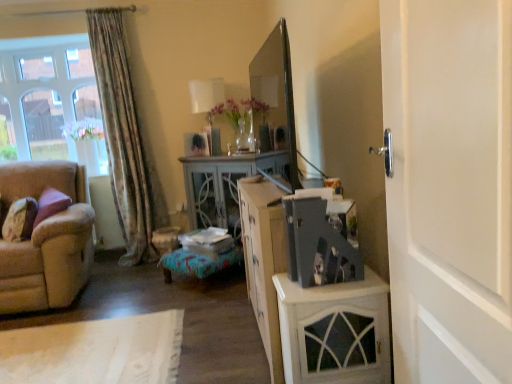
Question: Is clear glass window at upper left at the back of white painted wood door at right?

Choices:
 (A) yes
 (B) no

Answer: (B)

Question: Is the surface of white painted wood door at right in direct contact with clear glass window at upper left?

Choices:
 (A) no
 (B) yes

Answer: (A)

Question: Is white painted wood door at right positioned beyond the bounds of clear glass window at upper left?

Choices:
 (A) no
 (B) yes

Answer: (B)

Question: Could you tell me if white painted wood door at right is turned towards clear glass window at upper left?

Choices:
 (A) yes
 (B) no

Answer: (B)

Question: Is white painted wood door at right closer to camera compared to clear glass window at upper left?

Choices:
 (A) no
 (B) yes

Answer: (B)

Question: Considering the positions of point (305, 288) and point (306, 240), is point (305, 288) closer or farther from the camera than point (306, 240)?

Choices:
 (A) farther
 (B) closer

Answer: (A)

Question: Looking at their shapes, would you say white painted wood cabinet at right is wider or thinner than matte gray photo album at center?

Choices:
 (A) wide
 (B) thin

Answer: (A)

Question: Looking at the image, does white painted wood cabinet at right seem bigger or smaller compared to matte gray photo album at center?

Choices:
 (A) big
 (B) small

Answer: (A)

Question: Which is correct: white painted wood cabinet at right is inside matte gray photo album at center, or outside of it?

Choices:
 (A) outside
 (B) inside

Answer: (A)

Question: Considering the relative positions of beige fabric couch at left and velvet purple pillow at left in the image provided, is beige fabric couch at left to the left or to the right of velvet purple pillow at left?

Choices:
 (A) left
 (B) right

Answer: (B)

Question: In the image, is beige fabric couch at left positioned in front of or behind velvet purple pillow at left?

Choices:
 (A) behind
 (B) front

Answer: (B)

Question: From a real-world perspective, is beige fabric couch at left positioned above or below velvet purple pillow at left?

Choices:
 (A) above
 (B) below

Answer: (B)

Question: From the image's perspective, relative to velvet purple pillow at left, is beige fabric couch at left above or below?

Choices:
 (A) below
 (B) above

Answer: (A)

Question: Is beige fabric couch at left wider or thinner than clear glass window at upper left?

Choices:
 (A) wide
 (B) thin

Answer: (A)

Question: Is beige fabric couch at left inside the boundaries of clear glass window at upper left, or outside?

Choices:
 (A) outside
 (B) inside

Answer: (A)